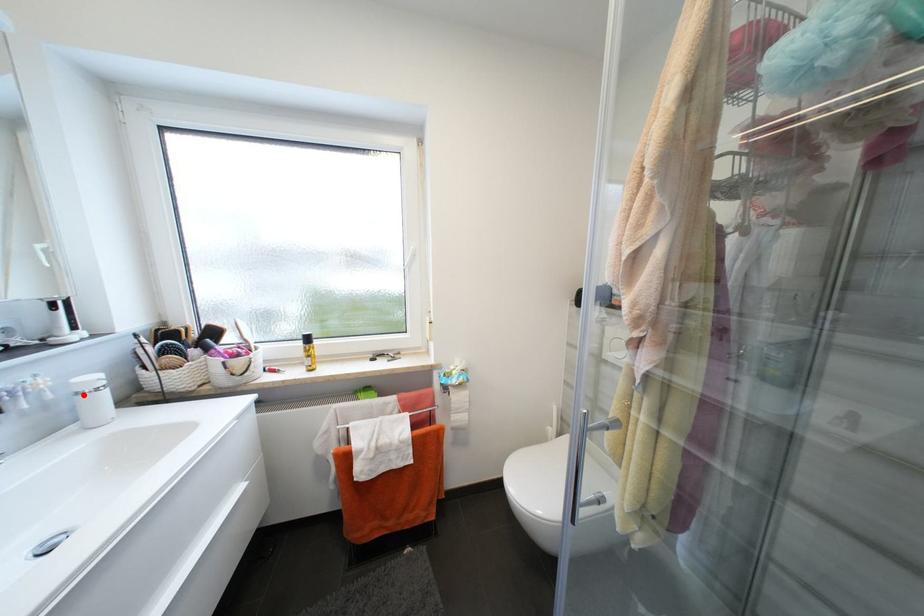
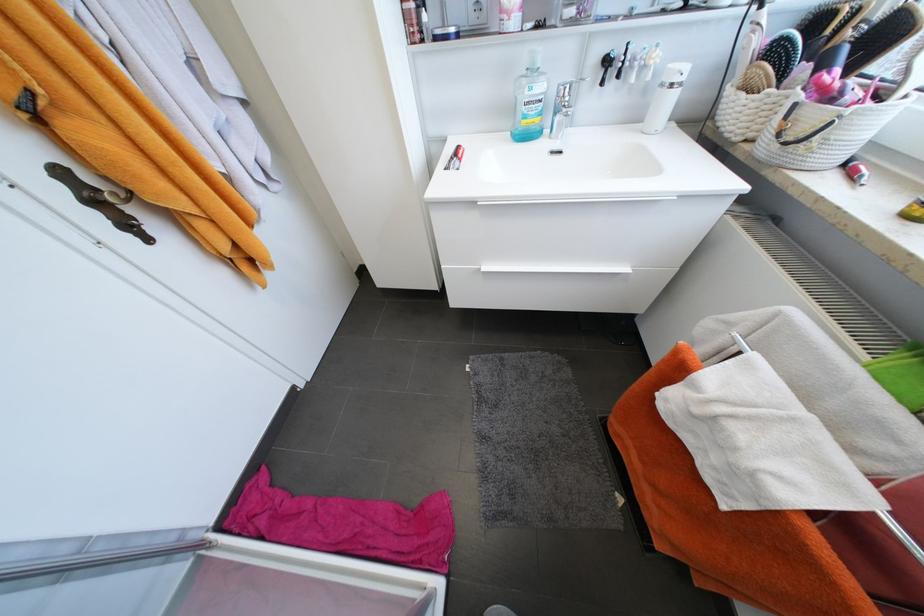
Where in the second image is the point corresponding to the highlighted location from the first image?

(667, 86)